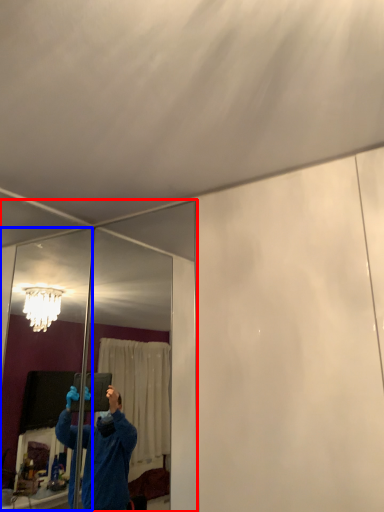
Question: Which point is closer to the camera, mirror (highlighted by a red box) or mirror (highlighted by a blue box)?

Choices:
 (A) mirror
 (B) mirror

Answer: (B)